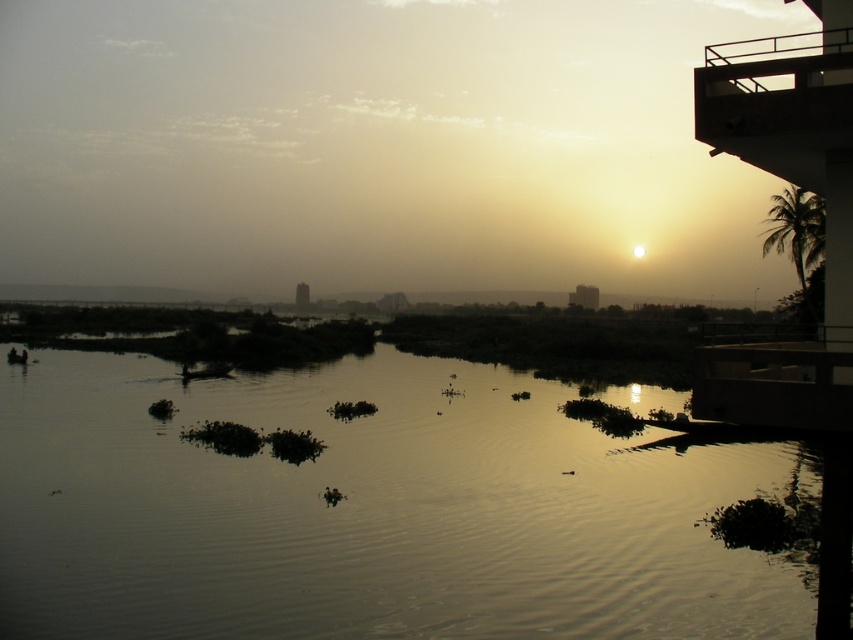
Question: Which object appears farthest from the camera in this image?

Choices:
 (A) silvery reflective water at center
 (B) metallic balcony at upper right

Answer: (B)

Question: Does silvery reflective water at center appear on the right side of metallic balcony at upper right?

Choices:
 (A) no
 (B) yes

Answer: (A)

Question: Which point is closer to the camera?

Choices:
 (A) (822, 140)
 (B) (4, 492)

Answer: (A)

Question: Where is silvery reflective water at center located in relation to metallic balcony at upper right in the image?

Choices:
 (A) left
 (B) right

Answer: (A)

Question: Which of the following is the closest to the observer?

Choices:
 (A) silvery reflective water at center
 (B) metallic balcony at upper right

Answer: (A)

Question: Can you confirm if silvery reflective water at center is positioned above metallic balcony at upper right?

Choices:
 (A) yes
 (B) no

Answer: (B)